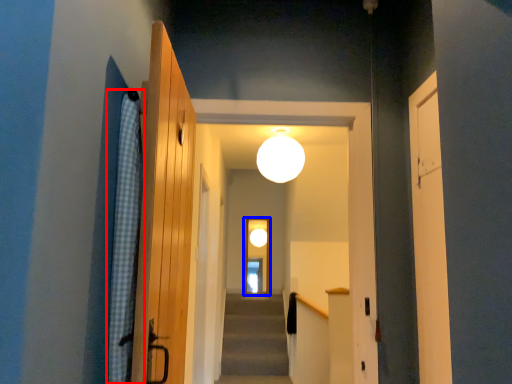
Question: Which point is closer to the camera, curtain (highlighted by a red box) or screen door (highlighted by a blue box)?

Choices:
 (A) curtain
 (B) screen door

Answer: (A)